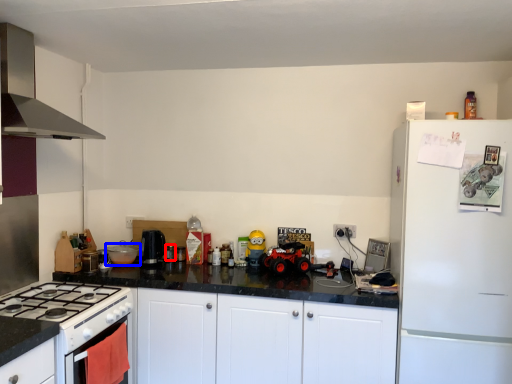
Question: Which of the following is the farthest to the observer, appliance (highlighted by a red box) or kitchen appliance (highlighted by a blue box)?

Choices:
 (A) appliance
 (B) kitchen appliance

Answer: (A)